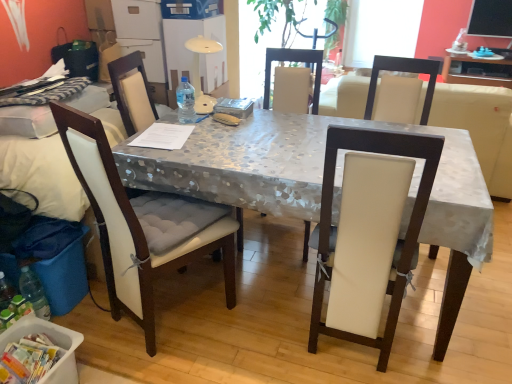
Question: Would you say metallic silver table at center contains white leather chair at center, the third chair viewed from the left?

Choices:
 (A) no
 (B) yes

Answer: (B)

Question: Can you confirm if metallic silver table at center is shorter than white leather chair at center, the third chair viewed from the left?

Choices:
 (A) yes
 (B) no

Answer: (A)

Question: Is metallic silver table at center positioned beyond the bounds of white leather chair at center, marked as the 1th chair in a right-to-left arrangement?

Choices:
 (A) yes
 (B) no

Answer: (A)

Question: From the image's perspective, is metallic silver table at center above white leather chair at center, marked as the 1th chair in a right-to-left arrangement?

Choices:
 (A) no
 (B) yes

Answer: (B)

Question: From the image's perspective, is metallic silver table at center under white leather chair at center, the third chair viewed from the left?

Choices:
 (A) yes
 (B) no

Answer: (B)

Question: From a real-world perspective, does metallic silver table at center stand above white leather chair at center, the third chair viewed from the left?

Choices:
 (A) yes
 (B) no

Answer: (B)

Question: Is white fabric chair at left, the 3th chair in the right-to-left sequence, at the left side of transparent plastic bottle at center?

Choices:
 (A) no
 (B) yes

Answer: (B)

Question: From the image's perspective, is white fabric chair at left, the 1th chair viewed from the left, under transparent plastic bottle at center?

Choices:
 (A) yes
 (B) no

Answer: (A)

Question: Does white fabric chair at left, the 3th chair in the right-to-left sequence, come in front of transparent plastic bottle at center?

Choices:
 (A) yes
 (B) no

Answer: (A)

Question: Can you confirm if white fabric chair at left, the 1th chair viewed from the left, is bigger than transparent plastic bottle at center?

Choices:
 (A) yes
 (B) no

Answer: (A)

Question: Is white fabric chair at left, the 1th chair viewed from the left, oriented towards transparent plastic bottle at center?

Choices:
 (A) yes
 (B) no

Answer: (B)

Question: Can you confirm if white fabric chair at left, the 1th chair viewed from the left, is smaller than transparent plastic bottle at center?

Choices:
 (A) no
 (B) yes

Answer: (A)

Question: From a real-world perspective, is metallic silver table at center over white plastic container at lower left?

Choices:
 (A) yes
 (B) no

Answer: (A)